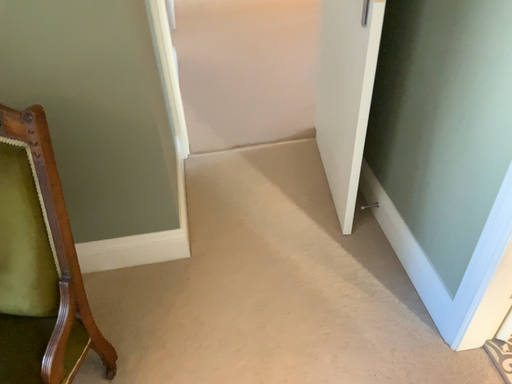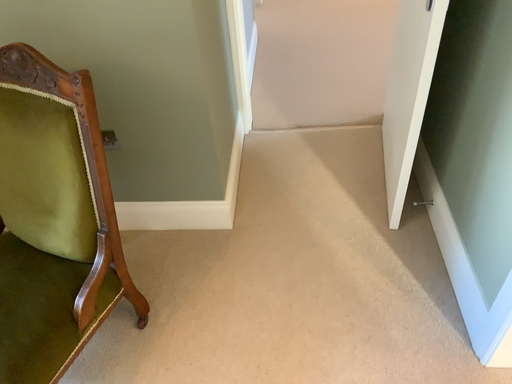
Question: How did the camera likely rotate when shooting the video?

Choices:
 (A) rotated right
 (B) rotated left

Answer: (B)